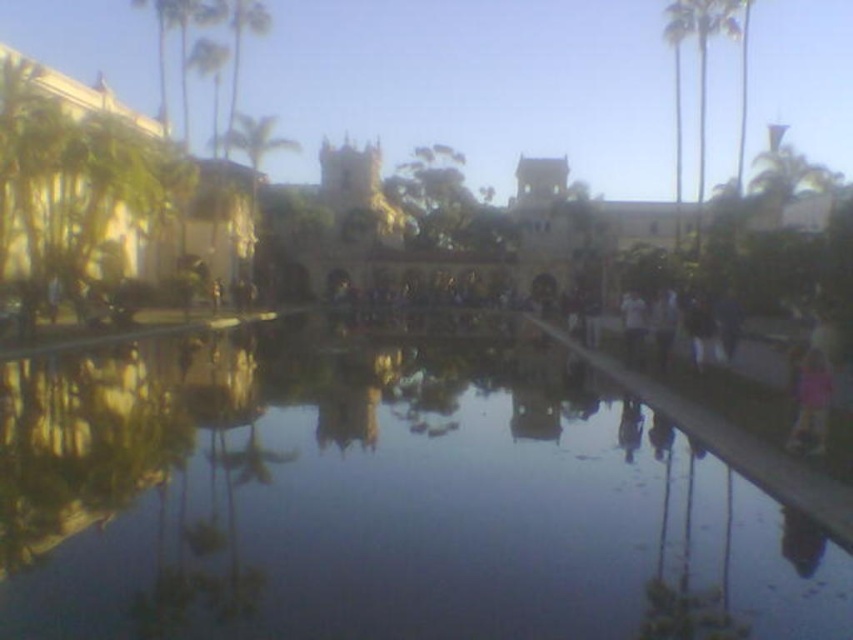
You are standing at the point closest to the camera in the image. Which point, point (161, 636) or point (671, 26), are you standing at?

You are standing at point (161, 636) because it is in front of point (671, 26).

You are standing at the origin point of the coordinate system in the scene. You want to pour a drink into a cup located at coordinate point 0.783, 0.447. Is the transparent liquid water at center already present at that location?

The transparent liquid water at center is positioned at point (380, 500), so yes, it is already present at that location.

You are standing at the edge of the water and want to take a photo of the green leafy palm tree at right without the transparent liquid water at center appearing in the foreground. Is this possible?

The transparent liquid water at center is in front of the green leafy palm tree at right, so it will block the view. You cannot take a photo of the green leafy palm tree at right without the transparent liquid water at center appearing in the foreground.